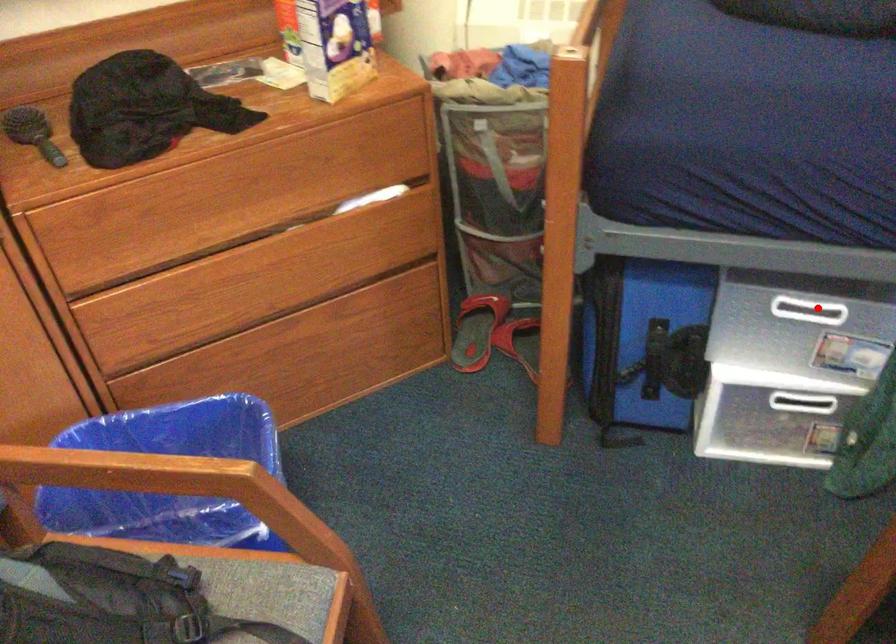
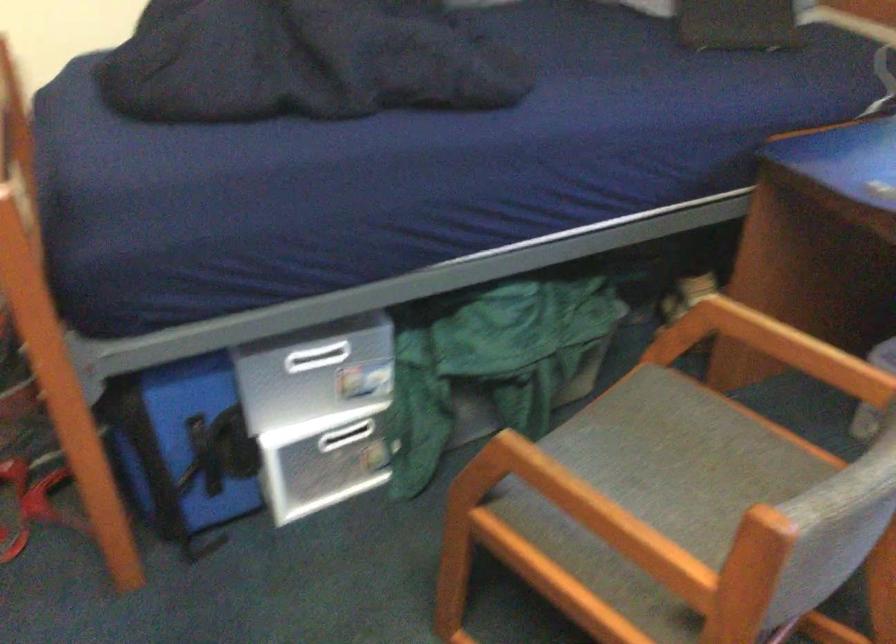
Locate, in the second image, the point that corresponds to the highlighted location in the first image.

(326, 355)